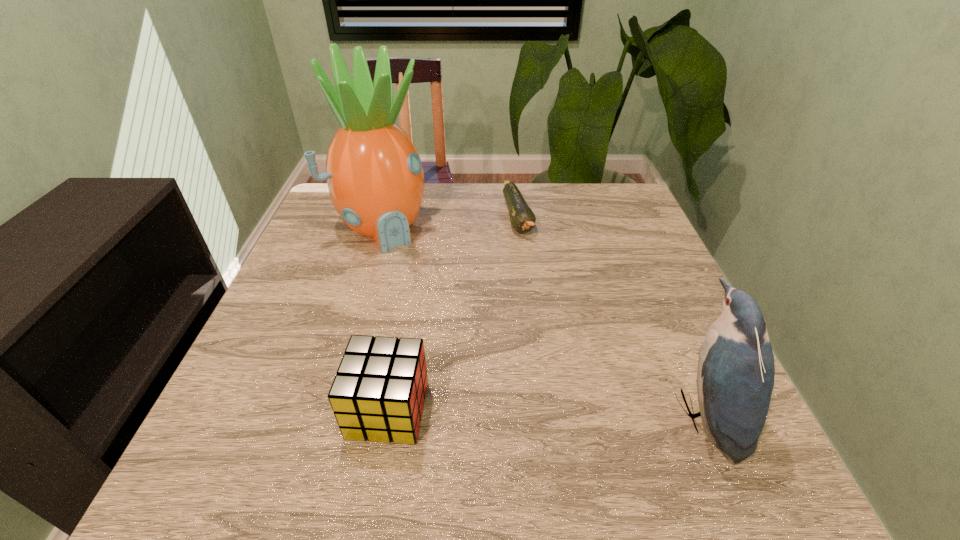
This screenshot has height=540, width=960. Identify the location of object that stands as the second closest to the shortest object. (735, 378).

The image size is (960, 540). Identify the location of object that is the third closest to the rightmost object. (374, 174).

Identify the location of vacant space that satisfies the following two spatial constraints: 1. on the front side of the bird; 2. at the tip of the tallest object's beak. (326, 413).